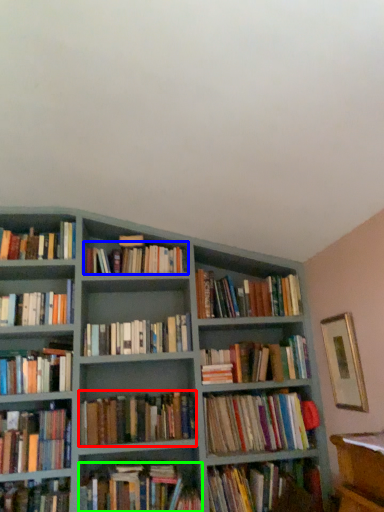
Question: Estimate the real-world distances between objects in this image. Which object is farther from book (highlighted by a red box), book (highlighted by a blue box) or book (highlighted by a green box)?

Choices:
 (A) book
 (B) book

Answer: (A)